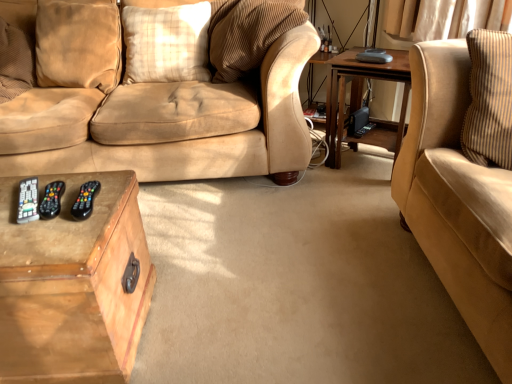
Where is `free space above wooden trunk at lower left, acting as the second table starting from the top (from a real-world perspective)`? This screenshot has height=384, width=512. free space above wooden trunk at lower left, acting as the second table starting from the top (from a real-world perspective) is located at coordinates (57, 201).